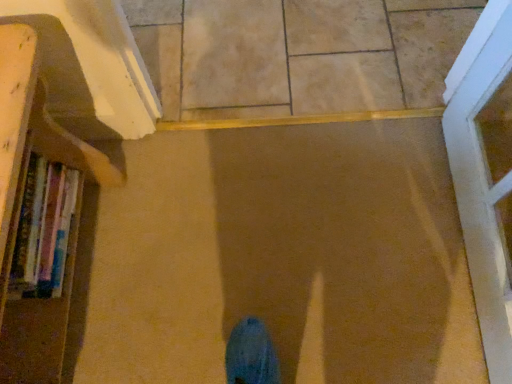
Question: Does wooden bookshelf at left have a lesser width compared to hardcover books at left?

Choices:
 (A) yes
 (B) no

Answer: (B)

Question: Can we say wooden bookshelf at left lies outside hardcover books at left?

Choices:
 (A) yes
 (B) no

Answer: (A)

Question: Considering the relative sizes of wooden bookshelf at left and hardcover books at left in the image provided, is wooden bookshelf at left smaller than hardcover books at left?

Choices:
 (A) no
 (B) yes

Answer: (A)

Question: Is wooden bookshelf at left looking in the opposite direction of hardcover books at left?

Choices:
 (A) yes
 (B) no

Answer: (A)

Question: From the image's perspective, is wooden bookshelf at left on hardcover books at left?

Choices:
 (A) yes
 (B) no

Answer: (B)

Question: Is hardcover books at left in front of or behind beige tile at center in the image?

Choices:
 (A) behind
 (B) front

Answer: (B)

Question: Would you say hardcover books at left is to the left or to the right of beige tile at center in the picture?

Choices:
 (A) left
 (B) right

Answer: (A)

Question: Is hardcover books at left taller or shorter than beige tile at center?

Choices:
 (A) tall
 (B) short

Answer: (A)

Question: From the image's perspective, relative to beige tile at center, is hardcover books at left above or below?

Choices:
 (A) below
 (B) above

Answer: (A)

Question: Is wooden bookshelf at left taller or shorter than hardcover books at left?

Choices:
 (A) tall
 (B) short

Answer: (A)

Question: In terms of width, does wooden bookshelf at left look wider or thinner when compared to hardcover books at left?

Choices:
 (A) wide
 (B) thin

Answer: (A)

Question: From a real-world perspective, is wooden bookshelf at left physically located above or below hardcover books at left?

Choices:
 (A) below
 (B) above

Answer: (B)

Question: Is point (108, 178) positioned closer to the camera than point (48, 246)?

Choices:
 (A) farther
 (B) closer

Answer: (A)

Question: In the image, is hardcover books at left positioned in front of or behind wooden bookshelf at left?

Choices:
 (A) front
 (B) behind

Answer: (B)

Question: Is point (38, 213) closer or farther from the camera than point (39, 140)?

Choices:
 (A) closer
 (B) farther

Answer: (B)